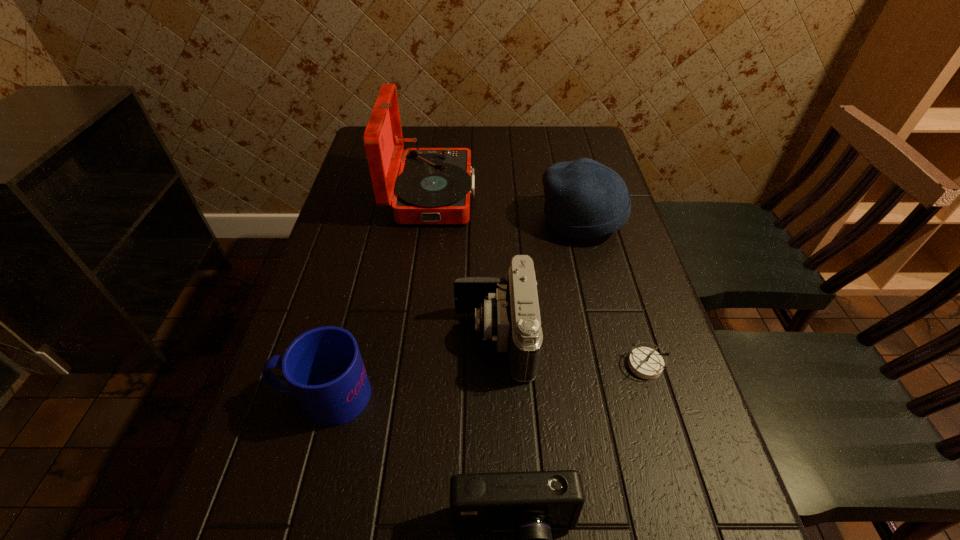
Where is `vacant space in between the skullcap and the taller camera`? vacant space in between the skullcap and the taller camera is located at coordinates (539, 279).

Find the location of a particular element. This screenshot has width=960, height=540. free space between the skullcap and the tallest object is located at coordinates (507, 207).

Image resolution: width=960 pixels, height=540 pixels. What are the coordinates of `vacant space that is in between the mug and the shortest object` in the screenshot? It's located at (484, 380).

Where is `empty space that is in between the mug and the skullcap`? This screenshot has height=540, width=960. empty space that is in between the mug and the skullcap is located at coordinates (453, 308).

Where is `unoccupied position between the skullcap and the tallest object`? This screenshot has height=540, width=960. unoccupied position between the skullcap and the tallest object is located at coordinates (507, 207).

Find the location of a particular element. Image resolution: width=960 pixels, height=540 pixels. free spot between the skullcap and the tallest object is located at coordinates (507, 207).

You are a GUI agent. You are given a task and a screenshot of the screen. Output one action in this format:
    pyautogui.click(x=<x>, y=<y>)
    Task: Click on the vacant area between the skullcap and the taller camera
    
    Given the screenshot: What is the action you would take?
    pyautogui.click(x=539, y=279)

I want to click on vacant area that lies between the shortest object and the tallest object, so click(538, 280).

I want to click on object that is the second closest to the nearest object, so click(323, 367).

The image size is (960, 540). What are the coordinates of `object that is the third closest to the shorter camera` in the screenshot? It's located at 646,363.